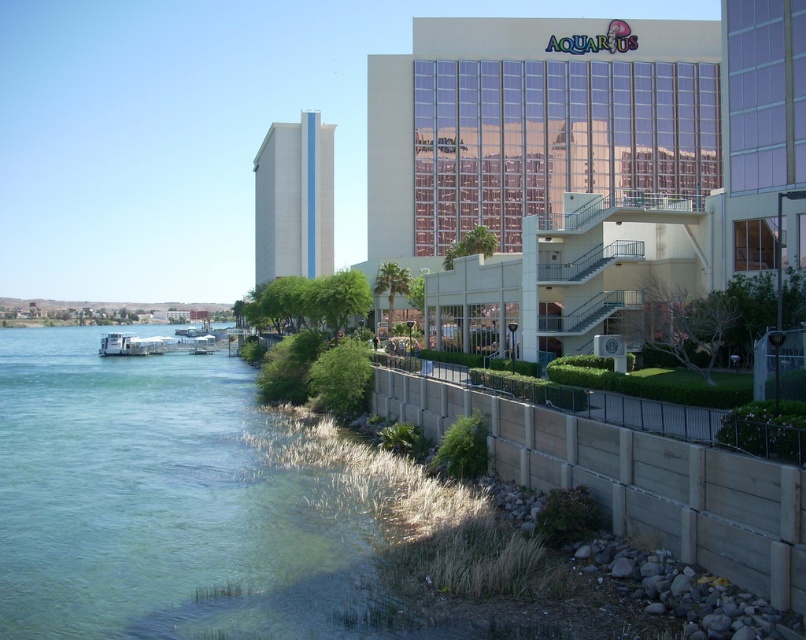
Between white smooth tower at center and white matte boat at lower left, which one has more height?

With more height is white smooth tower at center.

In order to click on white smooth tower at center in this screenshot , I will do `click(293, 198)`.

Is point (93, 536) farther from camera compared to point (372, 108)?

That is False.

Can you confirm if clear water at lower left is bigger than glassy reflective building at upper center?

No, clear water at lower left is not bigger than glassy reflective building at upper center.

At what (x,y) coordinates should I click in order to perform the action: click on clear water at lower left. Please return your answer as a coordinate pair (x, y). Image resolution: width=806 pixels, height=640 pixels. Looking at the image, I should click on (171, 504).

The height and width of the screenshot is (640, 806). Find the location of `clear water at lower left`. clear water at lower left is located at coordinates tap(171, 504).

Does clear water at lower left appear on the left side of white smooth tower at center?

Incorrect, clear water at lower left is not on the left side of white smooth tower at center.

Does point (56, 422) come closer to viewer compared to point (256, 180)?

Yes, it is in front of point (256, 180).

At what (x,y) coordinates should I click in order to perform the action: click on clear water at lower left. Please return your answer as a coordinate pair (x, y). The height and width of the screenshot is (640, 806). Looking at the image, I should click on (171, 504).